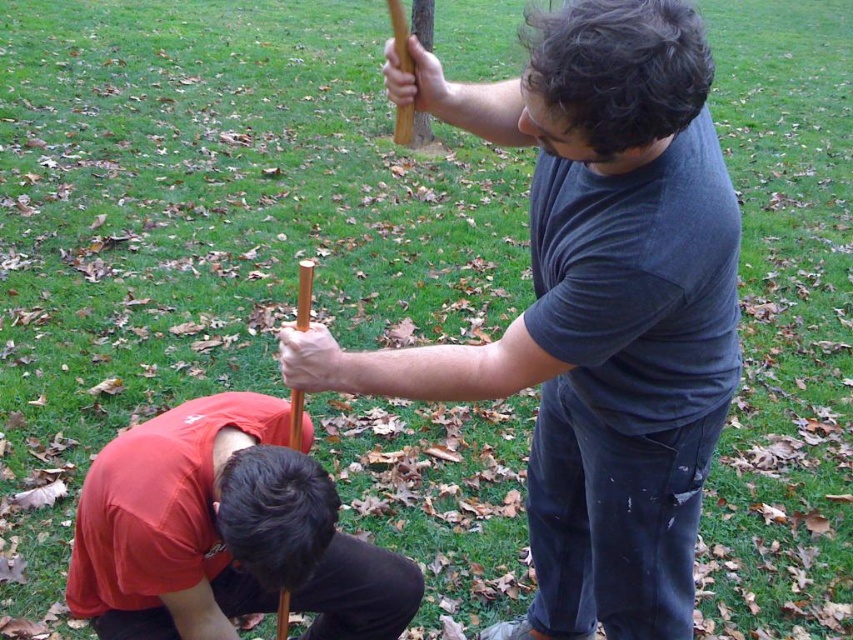
You are a photographer trying to capture a photo of the two people in the scene. You want to ensure that the matte black shirt at upper right and the matte red shirt at lower left are both visible in the frame. Based on their positions, which shirt will appear larger in the photo?

The matte black shirt at upper right is positioned over the matte red shirt at lower left, so it will appear larger in the photo due to its closer proximity to the camera.

You are taking a photo of the two people in the scene. You want to focus on the person closer to the camera. Which point should you focus on, point (577, 508) or point (223, 522)?

Point (577, 508) is further to the camera than point (223, 522), so you should focus on point (577, 508) to capture the person closer to the camera.

You are a photographer trying to capture a photo where the matte black shirt at upper right and the matte red shirt at lower left are both visible. Since you want the taller person to be in the foreground, which shirt should you focus on first?

The matte black shirt at upper right is taller than the matte red shirt at lower left. To have the taller person in the foreground, focus on the matte black shirt at upper right first.